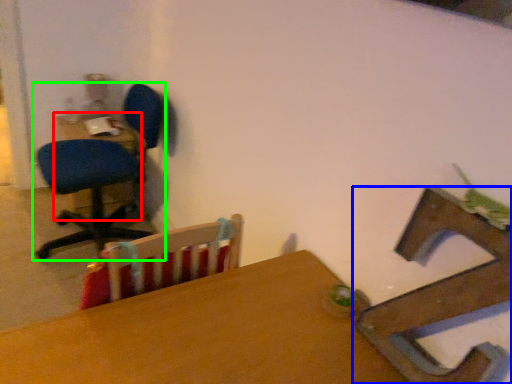
Question: Which object is positioned farthest from table (highlighted by a red box)? Select from chair (highlighted by a blue box) and chair (highlighted by a green box).

Choices:
 (A) chair
 (B) chair

Answer: (A)